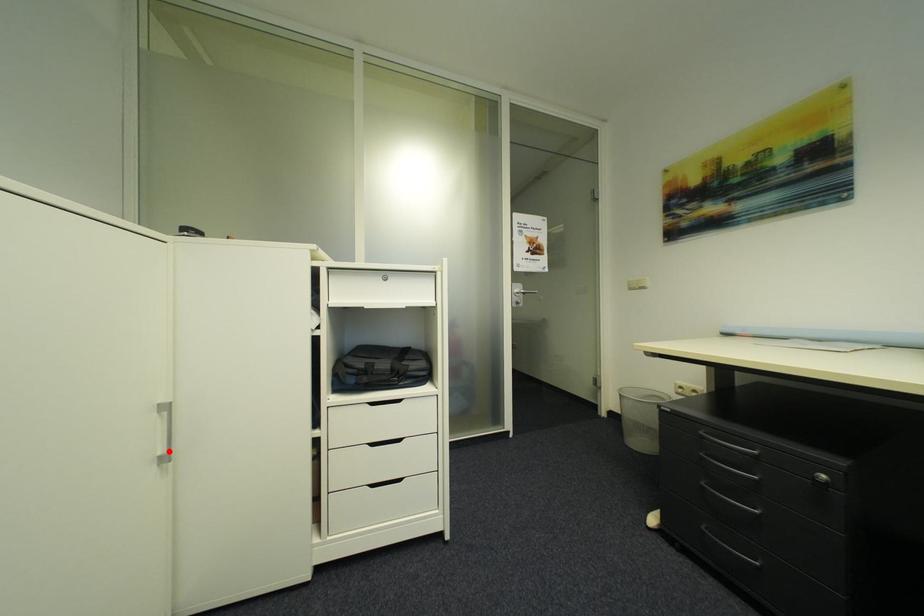
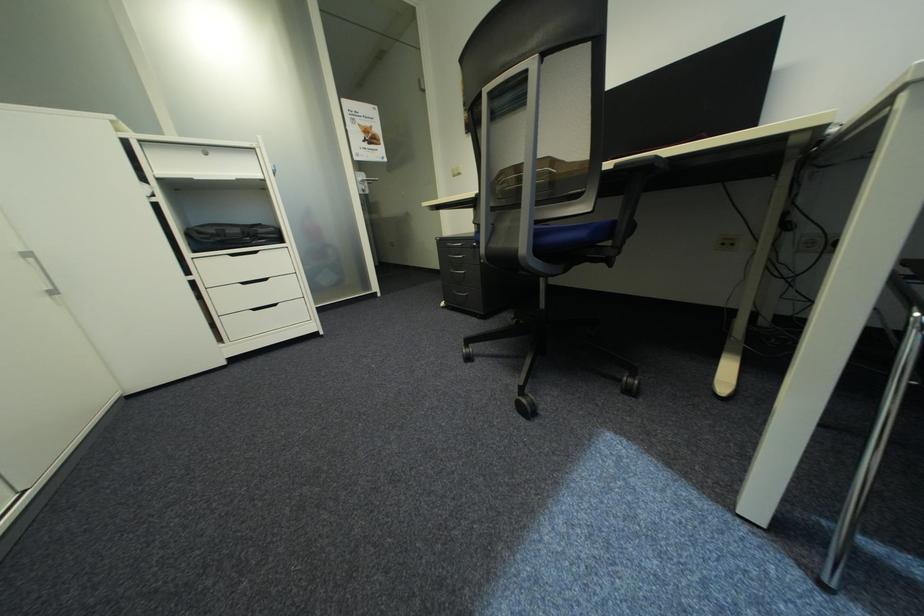
Question: I am providing you with two images of the same scene from different viewpoints. Given a red point in image1, look at the same physical point in image2. Is it:

Choices:
 (A) Closer to the viewpoint
 (B) Farther from the viewpoint

Answer: (B)